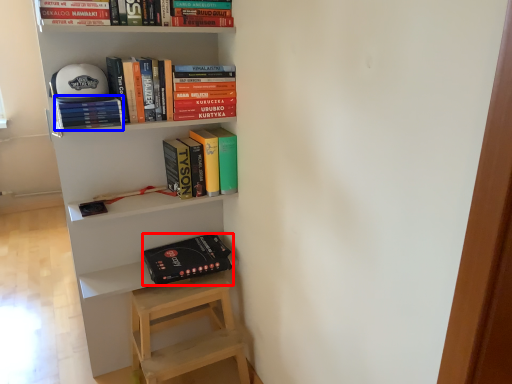
Question: Which point is closer to the camera, paperback book (highlighted by a red box) or book (highlighted by a blue box)?

Choices:
 (A) paperback book
 (B) book

Answer: (B)